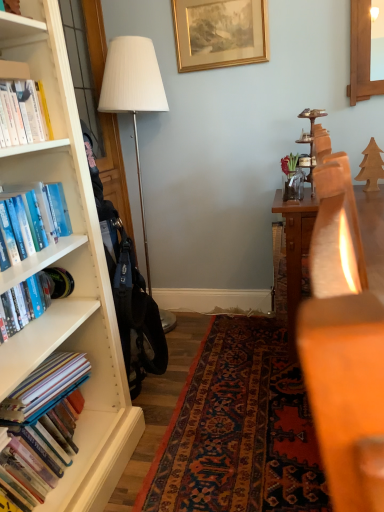
What do you see at coordinates (220, 33) in the screenshot?
I see `gold metallic picture frame at upper center` at bounding box center [220, 33].

At what (x,y) coordinates should I click in order to perform the action: click on gold metallic picture frame at upper center. Please return your answer as a coordinate pair (x, y). The image size is (384, 512). Looking at the image, I should click on (220, 33).

You are a GUI agent. You are given a task and a screenshot of the screen. Output one action in this format:
    pyautogui.click(x=<x>, y=<y>)
    Task: Click on the hardcover books at left, which appears as the fourth book when viewed from the top
    This screenshot has width=384, height=512.
    Given the screenshot: What is the action you would take?
    pyautogui.click(x=40, y=429)

Image resolution: width=384 pixels, height=512 pixels. What do you see at coordinates (44, 388) in the screenshot?
I see `hardcover books at left, arranged as the third book when viewed from the top` at bounding box center [44, 388].

Where is `hardcover books at left, arranged as the third book when viewed from the top`? hardcover books at left, arranged as the third book when viewed from the top is located at coordinates (44, 388).

What is the approximate height of hardcover book at left, which is counted as the third book, starting from the bottom?

It is 7.70 inches.

I want to click on gold metallic picture frame at upper center, so click(220, 33).

Which is correct: hardcover book at left, which is counted as the third book, starting from the bottom, is inside white fabric lampshade at left, or outside of it?

hardcover book at left, which is counted as the third book, starting from the bottom, is not inside white fabric lampshade at left, it's outside.

Which object is further away from the camera taking this photo, hardcover book at left, placed as the 2th book when sorted from top to bottom, or white fabric lampshade at left?

white fabric lampshade at left.

Where is `lamp lying behind the hardcover book at left, which is counted as the third book, starting from the bottom`? This screenshot has width=384, height=512. lamp lying behind the hardcover book at left, which is counted as the third book, starting from the bottom is located at coordinates (133, 94).

Which object is positioned more to the left, hardcover book at left, placed as the 2th book when sorted from top to bottom, or white fabric lampshade at left?

Positioned to the left is hardcover book at left, placed as the 2th book when sorted from top to bottom.

From a real-world perspective, is hardcover books at left, positioned as the first book in bottom-to-top order, located higher than hardcover books at left, arranged as the second book when ordered from the bottom?

No, from a real-world perspective, hardcover books at left, positioned as the first book in bottom-to-top order, is not on top of hardcover books at left, arranged as the second book when ordered from the bottom.

Can you confirm if hardcover books at left, which appears as the fourth book when viewed from the top, is thinner than hardcover books at left, arranged as the third book when viewed from the top?

In fact, hardcover books at left, which appears as the fourth book when viewed from the top, might be wider than hardcover books at left, arranged as the third book when viewed from the top.

Does point (60, 461) appear closer or farther from the camera than point (54, 377)?

Point (60, 461).

Can hardcover books at left, arranged as the second book when ordered from the bottom, be found inside hardcover books at left, positioned as the first book in bottom-to-top order?

That's correct, hardcover books at left, arranged as the second book when ordered from the bottom, is inside hardcover books at left, positioned as the first book in bottom-to-top order.

From a real-world perspective, is white fabric lampshade at left on gold metallic picture frame at upper center?

No.

Could you tell me if white fabric lampshade at left is facing gold metallic picture frame at upper center?

Yes, white fabric lampshade at left is turned towards gold metallic picture frame at upper center.

Is white fabric lampshade at left further to the viewer compared to gold metallic picture frame at upper center?

No, white fabric lampshade at left is in front of gold metallic picture frame at upper center.

This screenshot has width=384, height=512. Identify the location of picture frame located above the white fabric lampshade at left (from the image's perspective). (220, 33).

Is point (29, 184) less distant than point (38, 305)?

Yes.

Who is shorter, blue hardcover book at left, the 4th book in the bottom-to-top sequence, or hardcover book at left, which is counted as the third book, starting from the bottom?

hardcover book at left, which is counted as the third book, starting from the bottom.

Could you tell me if blue hardcover book at left, the first book viewed from the top, is turned towards hardcover book at left, placed as the 2th book when sorted from top to bottom?

No, blue hardcover book at left, the first book viewed from the top, is not oriented towards hardcover book at left, placed as the 2th book when sorted from top to bottom.

From the image's perspective, is hardcover book at left, which is counted as the third book, starting from the bottom, above hardcover books at left, arranged as the third book when viewed from the top?

Indeed, from the image's perspective, hardcover book at left, which is counted as the third book, starting from the bottom, is shown above hardcover books at left, arranged as the third book when viewed from the top.

From the hardcover book at left, placed as the 2th book when sorted from top to bottom, count 2nd book to the right and point to it. Please provide its 2D coordinates.

[(44, 388)]

Does hardcover book at left, which is counted as the third book, starting from the bottom, appear on the left side of hardcover books at left, arranged as the third book when viewed from the top?

Yes, hardcover book at left, which is counted as the third book, starting from the bottom, is to the left of hardcover books at left, arranged as the third book when viewed from the top.

Is hardcover book at left, placed as the 2th book when sorted from top to bottom, touching hardcover books at left, arranged as the third book when viewed from the top?

No, hardcover book at left, placed as the 2th book when sorted from top to bottom, is not beside hardcover books at left, arranged as the third book when viewed from the top.

Would you say hardcover books at left, which appears as the fourth book when viewed from the top, contains gold metallic picture frame at upper center?

No, gold metallic picture frame at upper center is not inside hardcover books at left, which appears as the fourth book when viewed from the top.

Which is more to the left, hardcover books at left, positioned as the first book in bottom-to-top order, or gold metallic picture frame at upper center?

hardcover books at left, positioned as the first book in bottom-to-top order, is more to the left.

Is hardcover books at left, which appears as the fourth book when viewed from the top, smaller than gold metallic picture frame at upper center?

Actually, hardcover books at left, which appears as the fourth book when viewed from the top, might be larger than gold metallic picture frame at upper center.

Considering the relative sizes of gold metallic picture frame at upper center and hardcover book at left, placed as the 2th book when sorted from top to bottom, in the image provided, is gold metallic picture frame at upper center smaller than hardcover book at left, placed as the 2th book when sorted from top to bottom,?

Actually, gold metallic picture frame at upper center might be larger than hardcover book at left, placed as the 2th book when sorted from top to bottom.

From the image's perspective, is gold metallic picture frame at upper center under hardcover book at left, placed as the 2th book when sorted from top to bottom?

No, from the image's perspective, gold metallic picture frame at upper center is not beneath hardcover book at left, placed as the 2th book when sorted from top to bottom.

Which is farther, (x=191, y=60) or (x=22, y=296)?

The point (x=191, y=60) is more distant.

Find the location of a particular element. lamp above the hardcover book at left, which is counted as the third book, starting from the bottom (from the image's perspective) is located at coordinates (133, 94).

The width and height of the screenshot is (384, 512). What are the coordinates of `book that is the 1st one above the hardcover books at left, which appears as the fourth book when viewed from the top (from a real-world perspective)` in the screenshot? It's located at (44, 388).

Which object lies further to the anchor point gold metallic picture frame at upper center, hardcover books at left, positioned as the first book in bottom-to-top order, or white fabric lampshade at left?

Among the two, hardcover books at left, positioned as the first book in bottom-to-top order, is located further to gold metallic picture frame at upper center.

Which object lies further to the anchor point hardcover books at left, arranged as the third book when viewed from the top, gold metallic picture frame at upper center or blue hardcover book at left, the first book viewed from the top?

gold metallic picture frame at upper center is positioned further to the anchor hardcover books at left, arranged as the third book when viewed from the top.

Which object lies nearer to the anchor point white fabric lampshade at left, hardcover books at left, positioned as the first book in bottom-to-top order, or hardcover books at left, arranged as the third book when viewed from the top?

hardcover books at left, positioned as the first book in bottom-to-top order, lies closer to white fabric lampshade at left than the other object.

Looking at the image, which one is located further to hardcover book at left, placed as the 2th book when sorted from top to bottom, gold metallic picture frame at upper center or blue hardcover book at left, the first book viewed from the top?

Based on the image, gold metallic picture frame at upper center appears to be further to hardcover book at left, placed as the 2th book when sorted from top to bottom.

Based on their spatial positions, is gold metallic picture frame at upper center or hardcover books at left, positioned as the first book in bottom-to-top order, further from blue hardcover book at left, the first book viewed from the top?

gold metallic picture frame at upper center.

Which object lies nearer to the anchor point hardcover book at left, which is counted as the third book, starting from the bottom, hardcover books at left, which appears as the fourth book when viewed from the top, or hardcover books at left, arranged as the second book when ordered from the bottom?

Based on the image, hardcover books at left, arranged as the second book when ordered from the bottom, appears to be nearer to hardcover book at left, which is counted as the third book, starting from the bottom.

Based on their spatial positions, is hardcover books at left, arranged as the third book when viewed from the top, or hardcover book at left, which is counted as the third book, starting from the bottom, further from gold metallic picture frame at upper center?

hardcover books at left, arranged as the third book when viewed from the top, is positioned further to the anchor gold metallic picture frame at upper center.

Looking at the image, which one is located further to hardcover books at left, positioned as the first book in bottom-to-top order, hardcover books at left, arranged as the second book when ordered from the bottom, or white fabric lampshade at left?

white fabric lampshade at left lies further to hardcover books at left, positioned as the first book in bottom-to-top order, than the other object.

You are a GUI agent. You are given a task and a screenshot of the screen. Output one action in this format:
    pyautogui.click(x=<x>, y=<y>)
    Task: Click on the book located between hardcover books at left, arranged as the second book when ordered from the bottom, and white fabric lampshade at left in the depth direction
    
    Given the screenshot: What is the action you would take?
    pyautogui.click(x=26, y=301)

The image size is (384, 512). In order to click on lamp between gold metallic picture frame at upper center and blue hardcover book at left, the first book viewed from the top, in the vertical direction in this screenshot , I will do `click(133, 94)`.

Image resolution: width=384 pixels, height=512 pixels. What are the coordinates of `lamp that lies between gold metallic picture frame at upper center and hardcover book at left, which is counted as the third book, starting from the bottom, from top to bottom` in the screenshot? It's located at (133, 94).

This screenshot has width=384, height=512. Find the location of `lamp between gold metallic picture frame at upper center and hardcover books at left, positioned as the first book in bottom-to-top order, in the up-down direction`. lamp between gold metallic picture frame at upper center and hardcover books at left, positioned as the first book in bottom-to-top order, in the up-down direction is located at coordinates (133, 94).